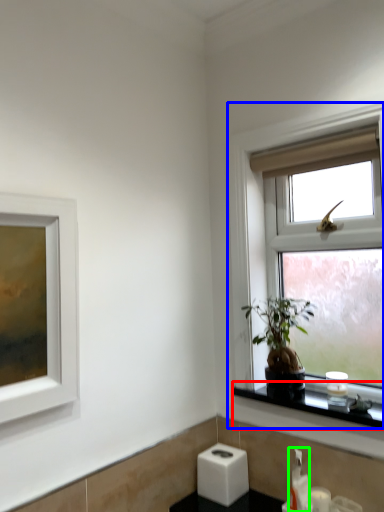
Question: Which object is positioned closest to window sill (highlighted by a red box)? Select from window (highlighted by a blue box) and soap dispenser (highlighted by a green box).

Choices:
 (A) window
 (B) soap dispenser

Answer: (B)